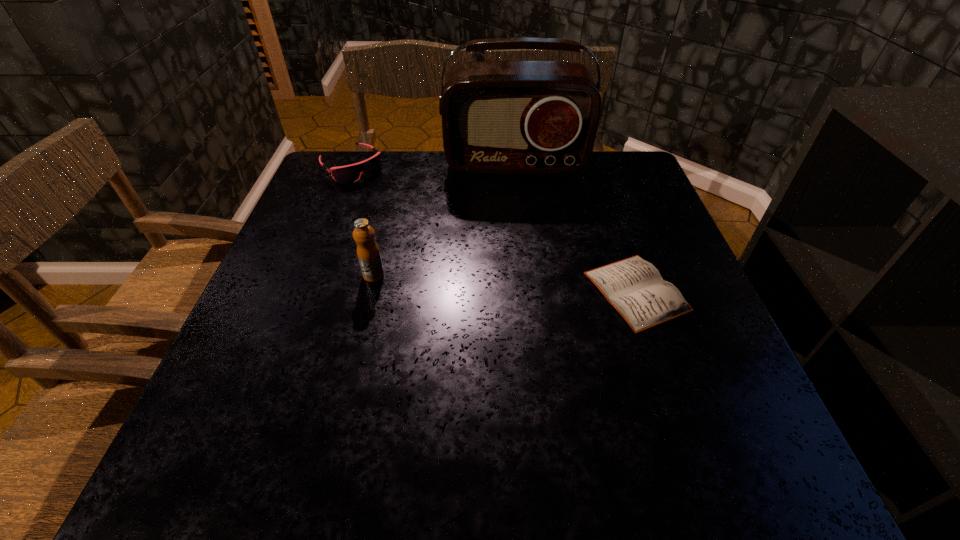
The image size is (960, 540). What are the coordinates of `orange juice` in the screenshot? It's located at (368, 253).

Locate an element on the screen. The image size is (960, 540). the second object from left to right is located at coordinates (368, 253).

At what (x,y) coordinates should I click in order to perform the action: click on diary. Please return your answer as a coordinate pair (x, y). The image size is (960, 540). Looking at the image, I should click on (634, 287).

I want to click on radio receiver, so click(x=498, y=117).

Image resolution: width=960 pixels, height=540 pixels. Identify the location of the leftmost object. (351, 173).

You are a GUI agent. You are given a task and a screenshot of the screen. Output one action in this format:
    pyautogui.click(x=<x>, y=<y>)
    Task: Click on the second shortest object
    The height and width of the screenshot is (540, 960).
    Given the screenshot: What is the action you would take?
    pyautogui.click(x=351, y=173)

Identify the location of free space located 0.160m on the front label of the orange juice. The width and height of the screenshot is (960, 540). (357, 345).

You are a GUI agent. You are given a task and a screenshot of the screen. Output one action in this format:
    pyautogui.click(x=<x>, y=<y>)
    Task: Click on the vacant space located 0.350m on the back of the shortest object
    The width and height of the screenshot is (960, 540).
    Given the screenshot: What is the action you would take?
    pyautogui.click(x=595, y=171)

Locate an element on the screen. This screenshot has width=960, height=540. free spot located 0.230m on the front panel of the radio receiver is located at coordinates (520, 229).

Identify the location of free space located 0.390m on the front panel of the radio receiver. (525, 276).